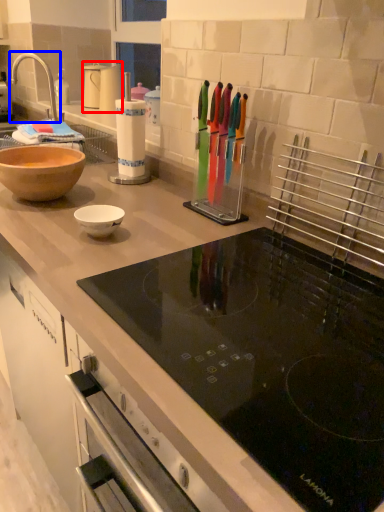
Question: Which point is further to the camera, kitchen appliance (highlighted by a red box) or tap (highlighted by a blue box)?

Choices:
 (A) kitchen appliance
 (B) tap

Answer: (A)